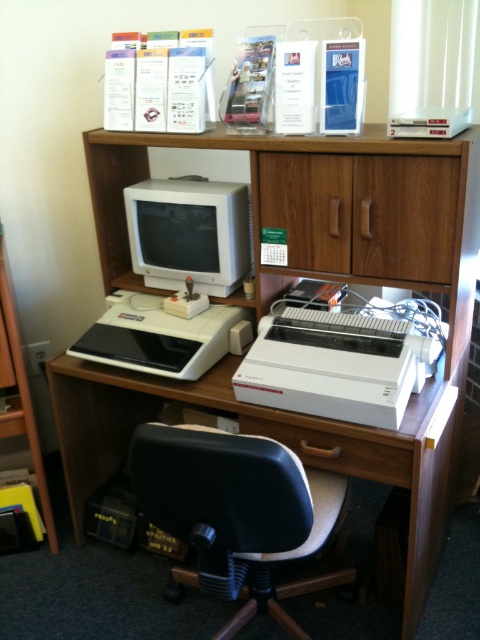
You are organizing the desk and need to place a new keyboard that is the same size as the wooden drawer at lower center. Can the space currently occupied by the matte white monitor at center fit the new keyboard?

The matte white monitor at center is bigger than wooden drawer at lower center. Since the new keyboard is the same size as the wooden drawer, the space currently occupied by the matte white monitor at center is larger and can accommodate the new keyboard.

You are standing in front of the desk and want to reach two points on the desk. The first point is at coordinate point (380, 209) and the second is at point (312, 380). Which point is closer to you?

Point (312, 380) is closer to you because it is less further to the camera than point (380, 209).

What object is located at the coordinate point (190,234) in the image?

The matte white monitor at center is located at the coordinate point (190,234).